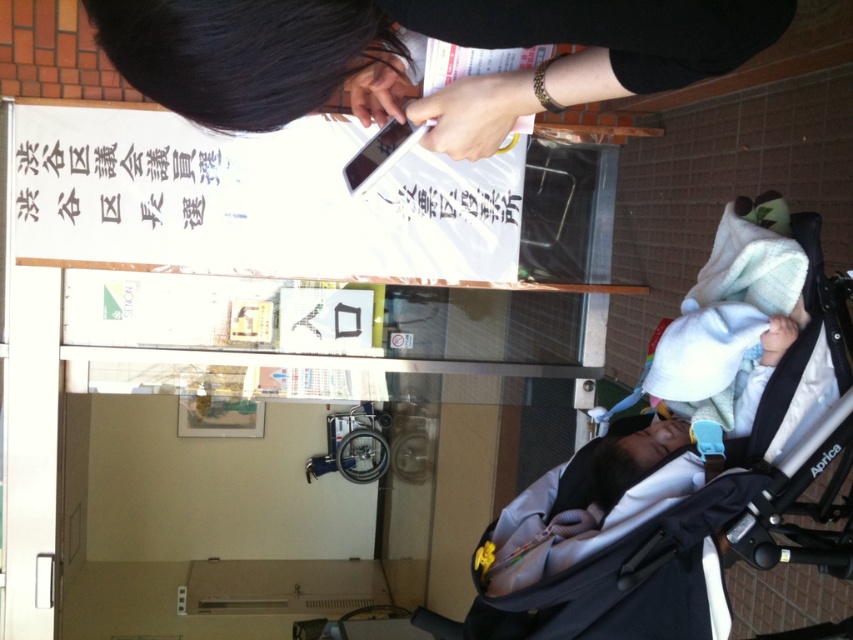
You are a photographer taking a picture of the voting banner. You notice the black fabric baby carriage at lower right and the black matte phone at upper center in your frame. Which object is closer to the camera?

The black fabric baby carriage at lower right is positioned under the black matte phone at upper center, meaning the black fabric baby carriage at lower right is closer to the camera.

From the picture: You are a photographer taking a picture of the voting banner at the entrance. You notice a black fabric baby carriage at lower right and a black matte phone at upper center in your frame. Which object will appear larger in your photo?

The black fabric baby carriage at lower right is taller than the black matte phone at upper center, so it will appear larger in the photo.

Looking at this image, you are standing at point (527, 33) and want to walk to point (744, 323). Is the path clear? Please explain.

Point (744, 323) is behind point (527, 33), so the path is blocked by the objects at point (527, 33).